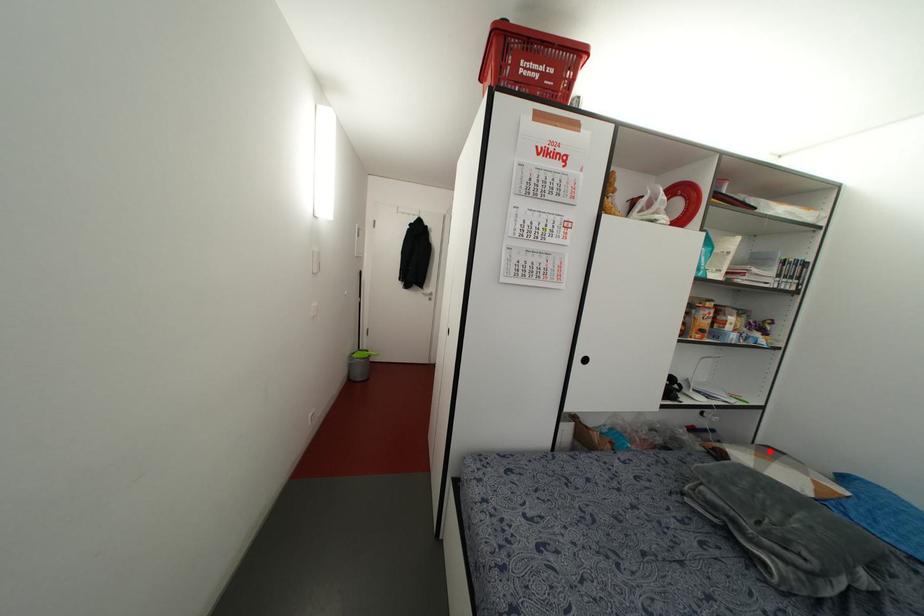
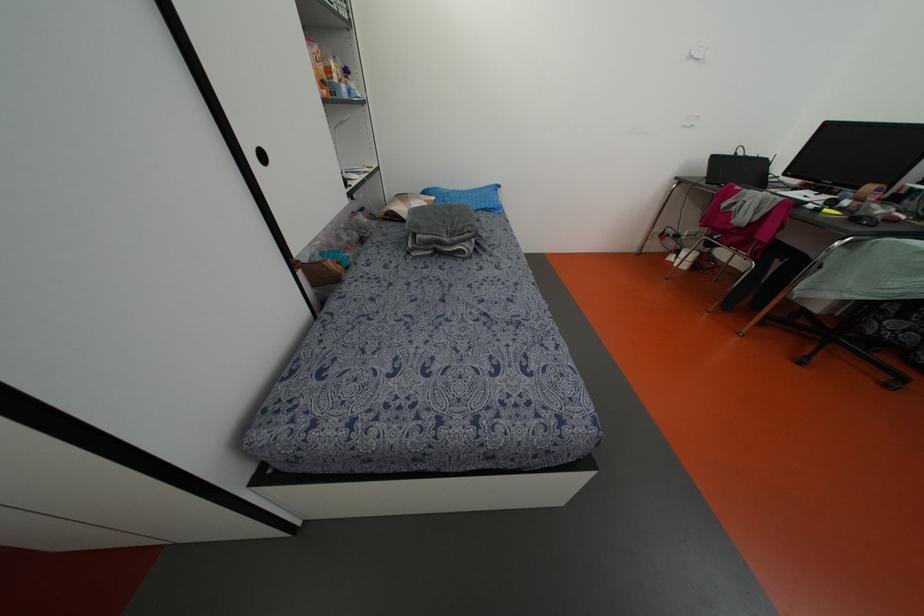
The point at the highlighted location is marked in the first image. Where is the corresponding point in the second image?

(402, 197)